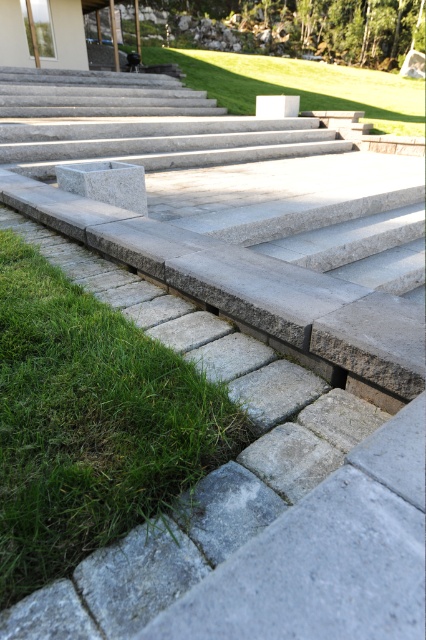
Does green grass at lower left appear under green grass at center?

Correct, green grass at lower left is located below green grass at center.

Who is taller, green grass at lower left or green grass at center?

Standing taller between the two is green grass at center.

Does point (32, 550) come behind point (204, 90)?

No, it is not.

The width and height of the screenshot is (426, 640). I want to click on green grass at lower left, so click(89, 422).